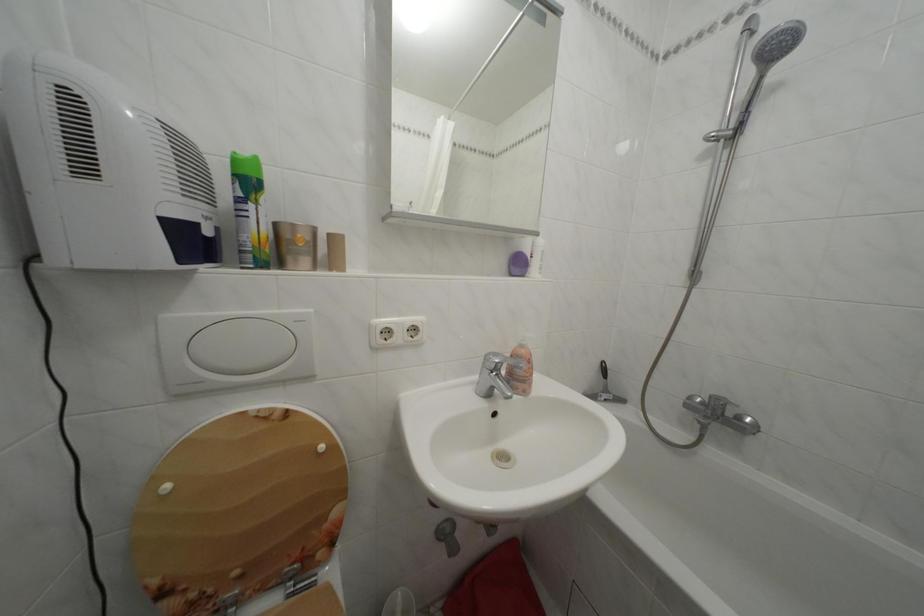
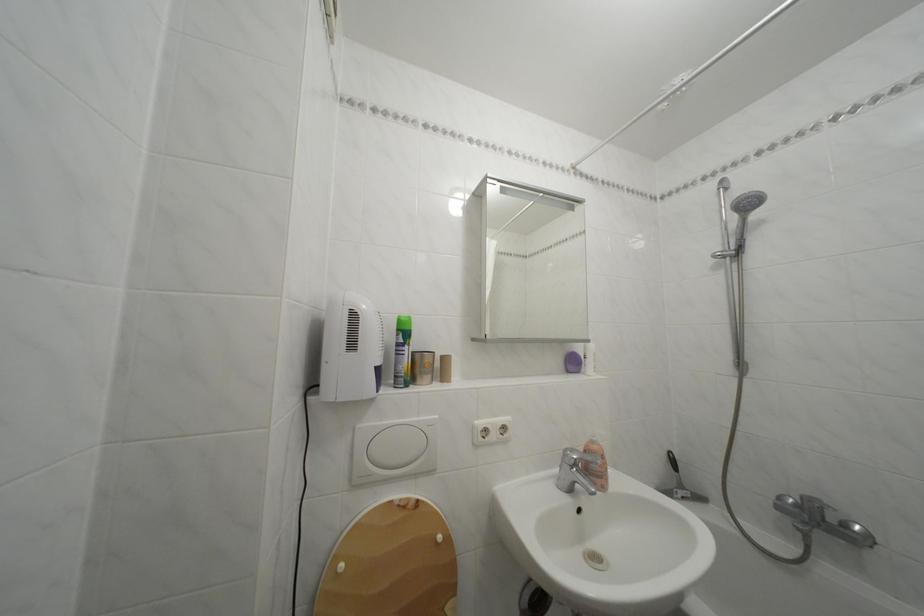
In the second image, find the point that corresponds to the point at 761,39 in the first image.

(736, 195)